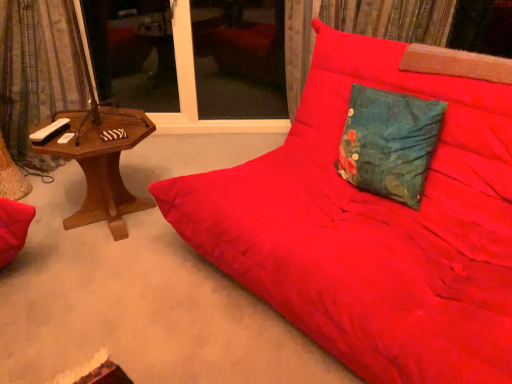
Image resolution: width=512 pixels, height=384 pixels. I want to click on free space in front of woodenmaterial/texturetable at left, so click(x=93, y=278).